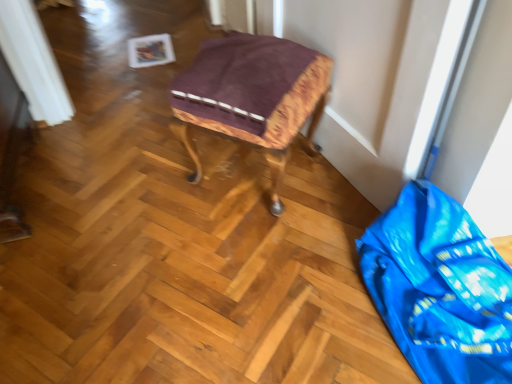
Where is `vacant area situated below wooden stool at center (from a real-world perspective)`? This screenshot has width=512, height=384. vacant area situated below wooden stool at center (from a real-world perspective) is located at coordinates click(x=256, y=178).